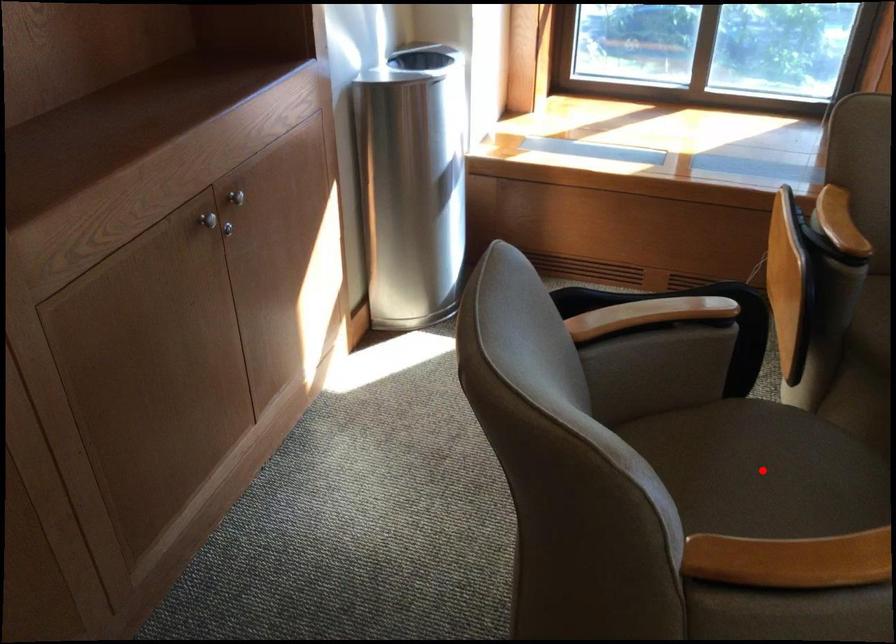
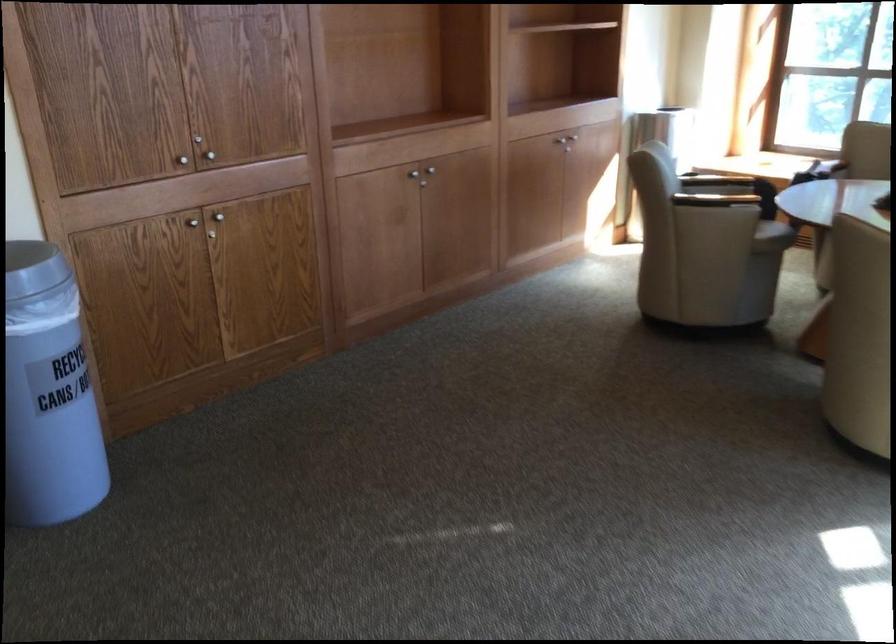
Question: I am providing you with two images of the same scene from different viewpoints. A red point is marked on the first image. Can you still see the location of the red point in image 2?

Choices:
 (A) Yes
 (B) No

Answer: (B)